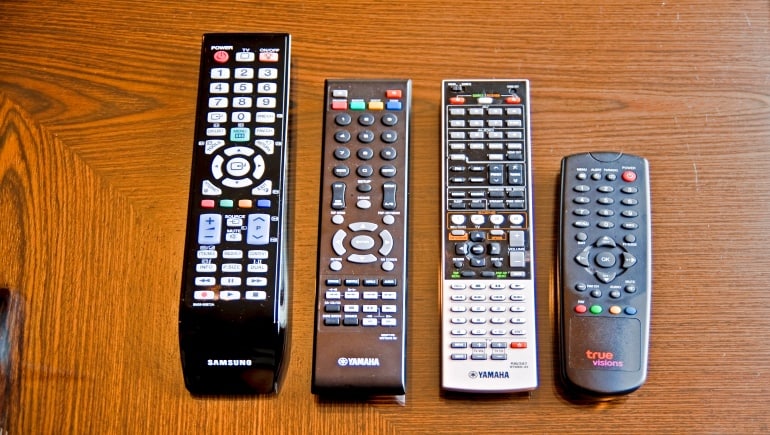
This screenshot has width=770, height=435. What are the coordinates of `true visions remote control` in the screenshot? It's located at (611, 356).